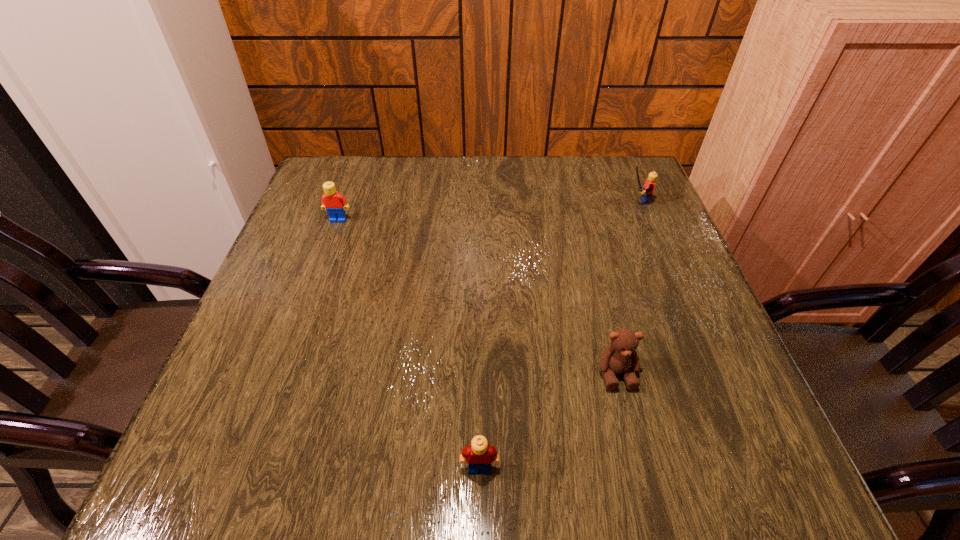
This screenshot has height=540, width=960. Find the location of `free space that satisfies the following two spatial constraints: 1. on the front-facing side of the farthest object; 2. on the face of the leftmost Lego`. free space that satisfies the following two spatial constraints: 1. on the front-facing side of the farthest object; 2. on the face of the leftmost Lego is located at coordinates (644, 220).

At what (x,y) coordinates should I click in order to perform the action: click on vacant point that satisfies the following two spatial constraints: 1. on the front-facing side of the rightmost Lego; 2. on the front-facing side of the second Lego from right to left. Please return your answer as a coordinate pair (x, y). The height and width of the screenshot is (540, 960). Looking at the image, I should click on (745, 468).

This screenshot has height=540, width=960. I want to click on free location that satisfies the following two spatial constraints: 1. on the front-facing side of the farthest object; 2. on the face of the leftmost object, so click(x=644, y=220).